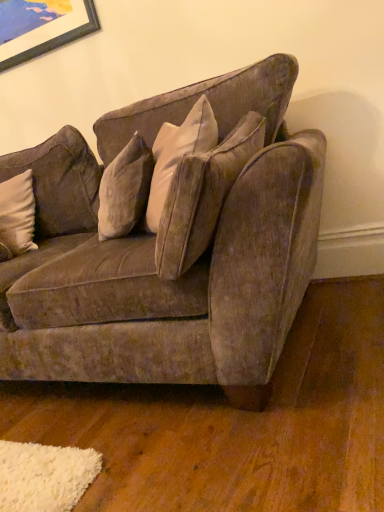
Question: Would you say white soft pillow at left is a long distance from velvet brown couch at center?

Choices:
 (A) no
 (B) yes

Answer: (A)

Question: Does white soft pillow at left have a lesser width compared to velvet brown couch at center?

Choices:
 (A) yes
 (B) no

Answer: (A)

Question: Is the position of white soft pillow at left more distant than that of velvet brown couch at center?

Choices:
 (A) yes
 (B) no

Answer: (A)

Question: Does white soft pillow at left have a greater width compared to velvet brown couch at center?

Choices:
 (A) no
 (B) yes

Answer: (A)

Question: Is white soft pillow at left completely or partially outside of velvet brown couch at center?

Choices:
 (A) yes
 (B) no

Answer: (B)

Question: Considering the relative positions of white soft pillow at left and velvet brown couch at center in the image provided, is white soft pillow at left in front of velvet brown couch at center?

Choices:
 (A) yes
 (B) no

Answer: (B)

Question: Can you confirm if velvet brown couch at center is taller than white soft pillow at left?

Choices:
 (A) no
 (B) yes

Answer: (B)

Question: From a real-world perspective, does velvet brown couch at center sit lower than white soft pillow at left?

Choices:
 (A) yes
 (B) no

Answer: (A)

Question: From a real-world perspective, is velvet brown couch at center over white soft pillow at left?

Choices:
 (A) yes
 (B) no

Answer: (B)

Question: Is velvet brown couch at center to the right of white soft pillow at left from the viewer's perspective?

Choices:
 (A) no
 (B) yes

Answer: (B)

Question: Is velvet brown couch at center looking in the opposite direction of white soft pillow at left?

Choices:
 (A) yes
 (B) no

Answer: (A)

Question: Does velvet brown couch at center come in front of white soft pillow at left?

Choices:
 (A) yes
 (B) no

Answer: (A)

Question: Is velvet brown couch at center inside or outside of white soft pillow at left?

Choices:
 (A) outside
 (B) inside

Answer: (A)